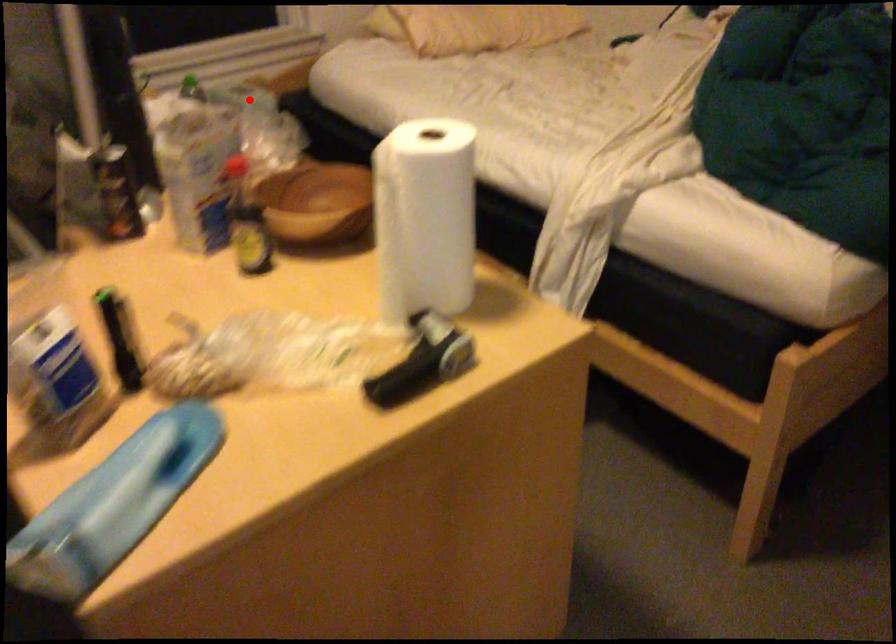
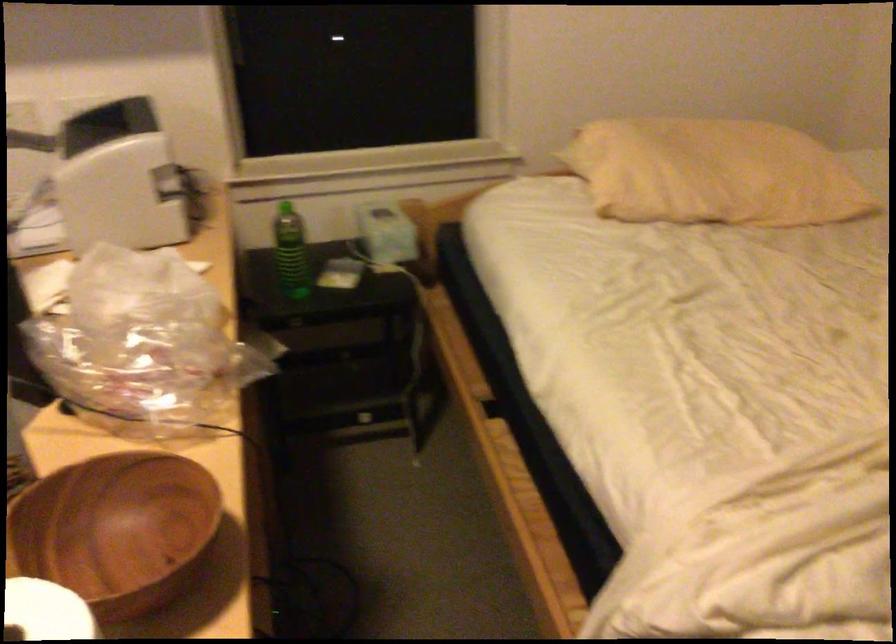
Locate, in the second image, the point that corresponds to the highlighted location in the first image.

(385, 232)